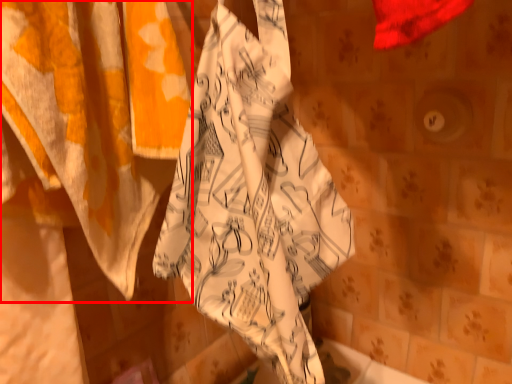
Question: From the image's perspective, where is curtain (annotated by the red box) located in relation to towel in the image?

Choices:
 (A) above
 (B) below

Answer: (B)